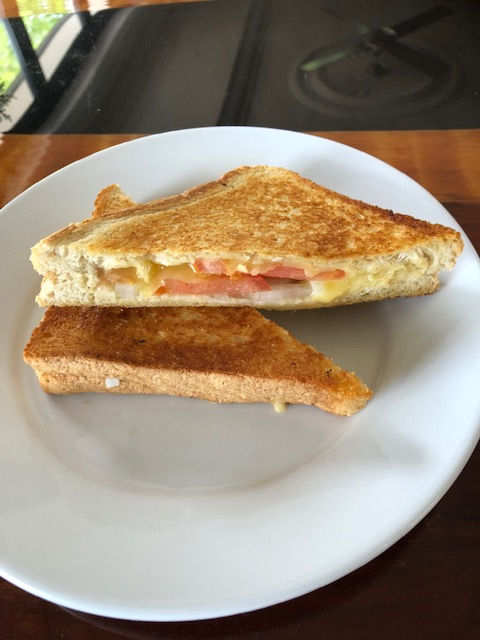
Identify the location of wood surface. (444, 176).